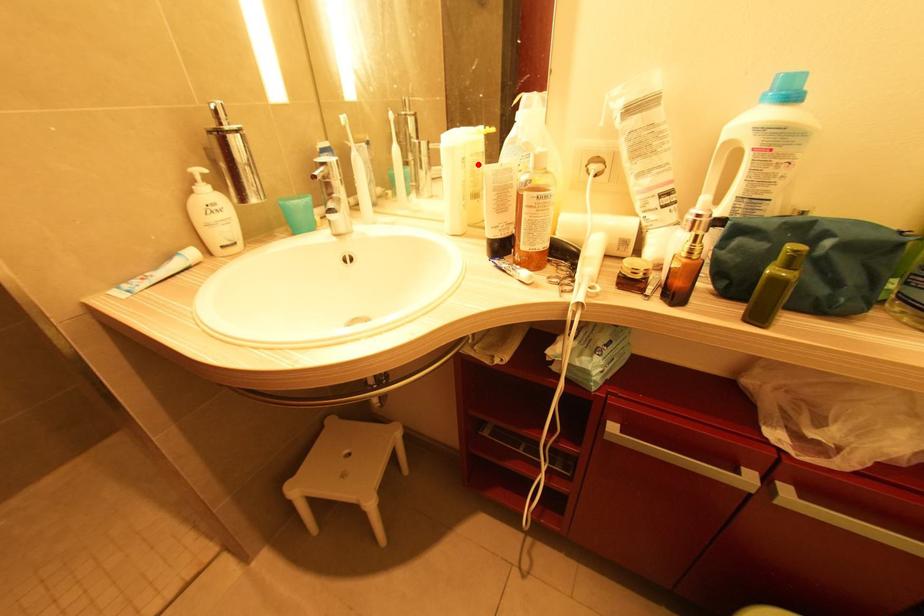
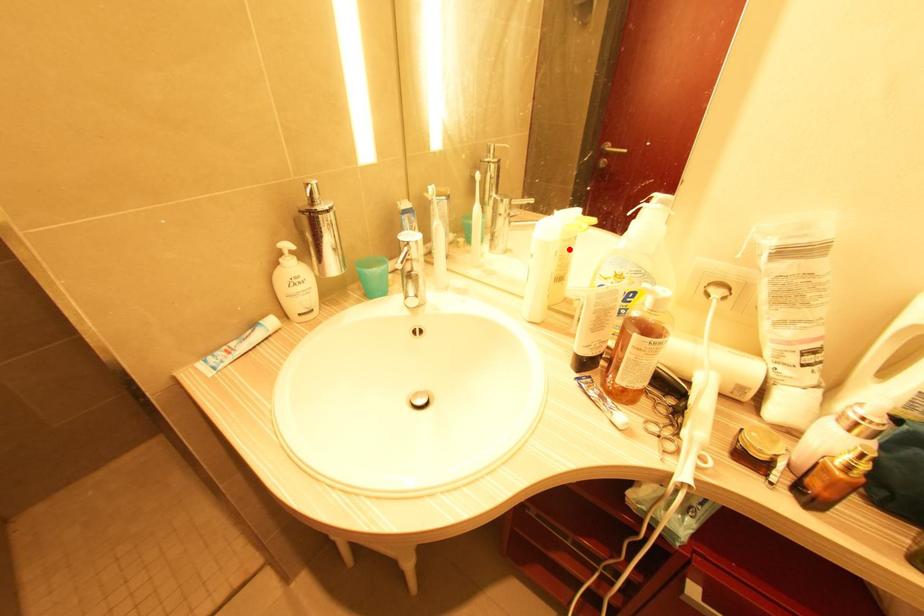
I am providing you with two images of the same scene from different viewpoints. A red point is marked on the first image and another point is marked on the second image. Does the point marked in image1 correspond to the same location as the one in image2?

Yes